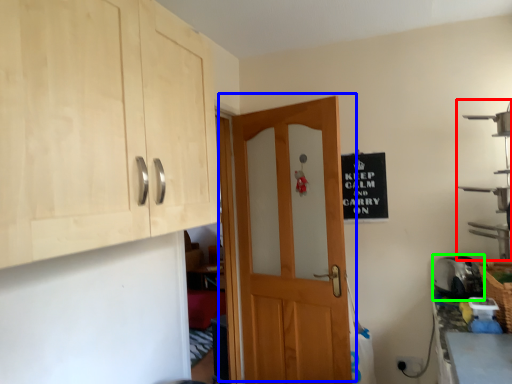
Question: Which object is the farthest from shelf (highlighted by a red box)? Choose among these: door (highlighted by a blue box) or appliance (highlighted by a green box).

Choices:
 (A) door
 (B) appliance

Answer: (A)